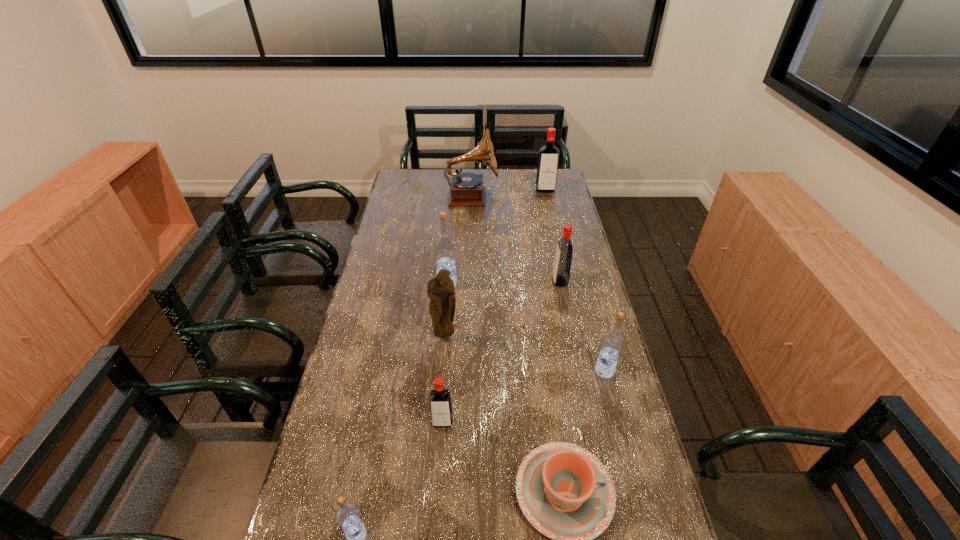
Identify the location of the second nearest vodka. (440, 402).

You are a GUI agent. You are given a task and a screenshot of the screen. Output one action in this format:
    pyautogui.click(x=<x>, y=<y>)
    Task: Click on the free region located 0.230m on the horn of the phonograph_record
    
    Given the screenshot: What is the action you would take?
    pyautogui.click(x=547, y=197)

This screenshot has height=540, width=960. Find the location of `blank space located on the front and back of the farthest red vodka`. blank space located on the front and back of the farthest red vodka is located at coordinates (549, 210).

This screenshot has width=960, height=540. Identify the location of vacant space located on the right of the second blue vodka from right to left. (496, 284).

This screenshot has height=540, width=960. In order to click on free space located 0.120m on the front-facing side of the figurine in this screenshot , I will do `click(443, 374)`.

At what (x,y) coordinates should I click in order to perform the action: click on vacant space situated on the front and back of the second farthest red vodka. Please return your answer as a coordinate pair (x, y). The width and height of the screenshot is (960, 540). Looking at the image, I should click on (534, 281).

Image resolution: width=960 pixels, height=540 pixels. I want to click on free location located 0.260m on the front and back of the second farthest red vodka, so click(x=481, y=281).

Locate an element on the screen. This screenshot has height=540, width=960. free space located on the front and back of the second farthest red vodka is located at coordinates (519, 281).

The image size is (960, 540). Identify the location of vacant space situated 0.180m on the back of the third nearest vodka. (591, 319).

Identify the location of free space located 0.220m on the front and back of the seventh farthest object. (436, 518).